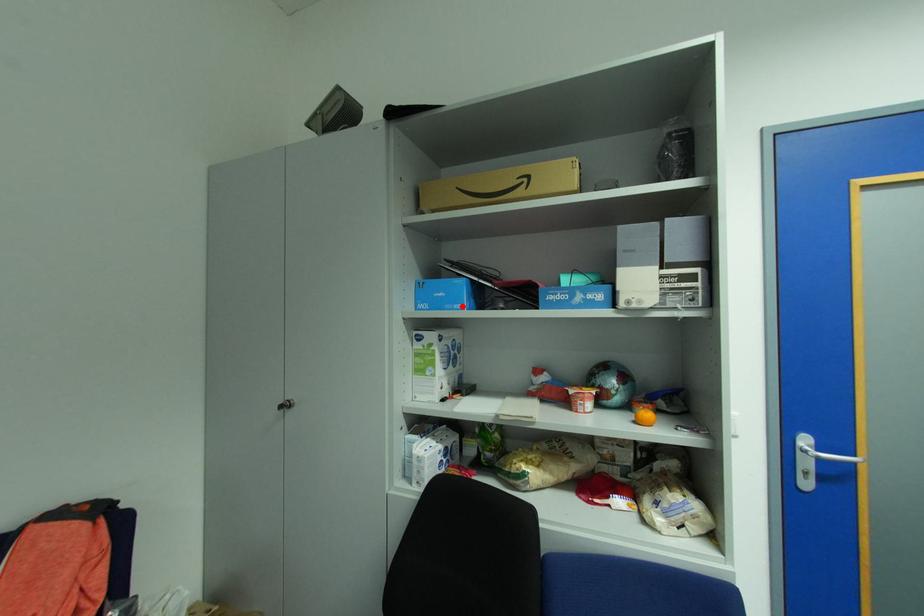
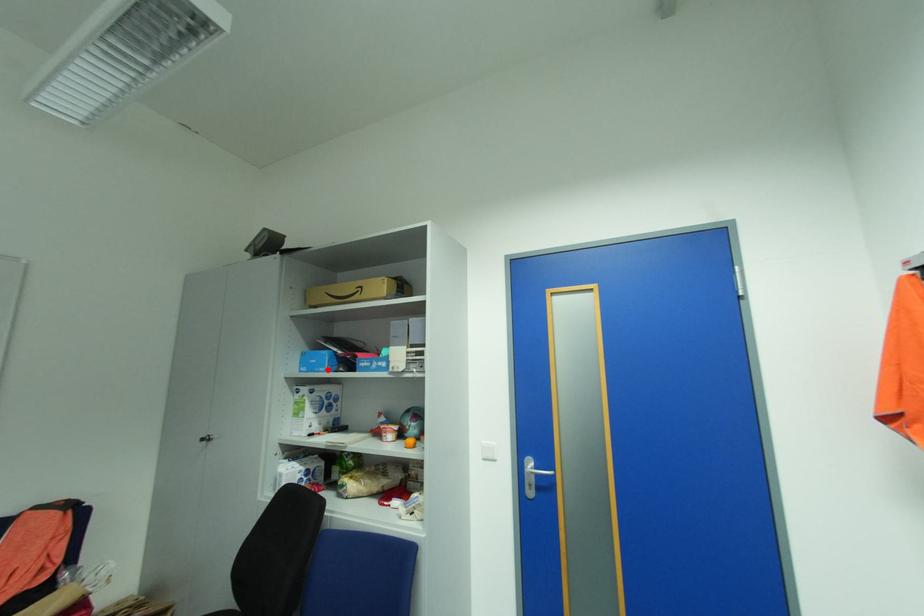
I am providing you with two images of the same scene from different viewpoints. A red point is marked on the first image and another point is marked on the second image. Are the points marked in image1 and image2 representing the same 3D position?

Yes